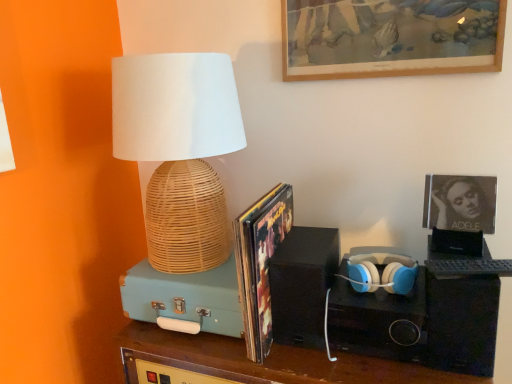
Question: From the image's perspective, is woven bamboo lamp at left on top of wooden picture frame at upper center, the 2th picture frame in the bottom-to-top sequence?

Choices:
 (A) yes
 (B) no

Answer: (B)

Question: Considering the relative sizes of woven bamboo lamp at left and wooden picture frame at upper center, the 2th picture frame in the bottom-to-top sequence, in the image provided, is woven bamboo lamp at left thinner than wooden picture frame at upper center, the 2th picture frame in the bottom-to-top sequence,?

Choices:
 (A) yes
 (B) no

Answer: (B)

Question: Is woven bamboo lamp at left far from wooden picture frame at upper center, marked as the first picture frame in a top-to-bottom arrangement?

Choices:
 (A) yes
 (B) no

Answer: (B)

Question: Can you confirm if woven bamboo lamp at left is bigger than wooden picture frame at upper center, the 2th picture frame in the bottom-to-top sequence?

Choices:
 (A) no
 (B) yes

Answer: (B)

Question: Can you confirm if woven bamboo lamp at left is wider than wooden picture frame at upper center, the 2th picture frame in the bottom-to-top sequence?

Choices:
 (A) no
 (B) yes

Answer: (B)

Question: Can you confirm if woven bamboo lamp at left is taller than wooden picture frame at upper center, marked as the first picture frame in a top-to-bottom arrangement?

Choices:
 (A) yes
 (B) no

Answer: (A)

Question: From the image's perspective, is matte black album cover at upper right, which ranks as the second picture frame in top-to-bottom order, beneath matte white and blue plastic headphones at center right?

Choices:
 (A) yes
 (B) no

Answer: (B)

Question: Does matte black album cover at upper right, which ranks as the second picture frame in top-to-bottom order, contain matte white and blue plastic headphones at center right?

Choices:
 (A) yes
 (B) no

Answer: (B)

Question: From a real-world perspective, is matte black album cover at upper right, which ranks as the first picture frame in bottom-to-top order, on top of matte white and blue plastic headphones at center right?

Choices:
 (A) no
 (B) yes

Answer: (B)

Question: Can you confirm if matte black album cover at upper right, which ranks as the second picture frame in top-to-bottom order, is thinner than matte white and blue plastic headphones at center right?

Choices:
 (A) yes
 (B) no

Answer: (A)

Question: Is matte black album cover at upper right, which ranks as the first picture frame in bottom-to-top order, bigger than matte white and blue plastic headphones at center right?

Choices:
 (A) yes
 (B) no

Answer: (B)

Question: Considering the relative positions of matte black album cover at upper right, which ranks as the first picture frame in bottom-to-top order, and matte white and blue plastic headphones at center right in the image provided, is matte black album cover at upper right, which ranks as the first picture frame in bottom-to-top order, behind matte white and blue plastic headphones at center right?

Choices:
 (A) no
 (B) yes

Answer: (B)

Question: From a real-world perspective, is matte white and blue plastic headphones at center right positioned under matte black album cover at upper right, which ranks as the second picture frame in top-to-bottom order, based on gravity?

Choices:
 (A) no
 (B) yes

Answer: (B)